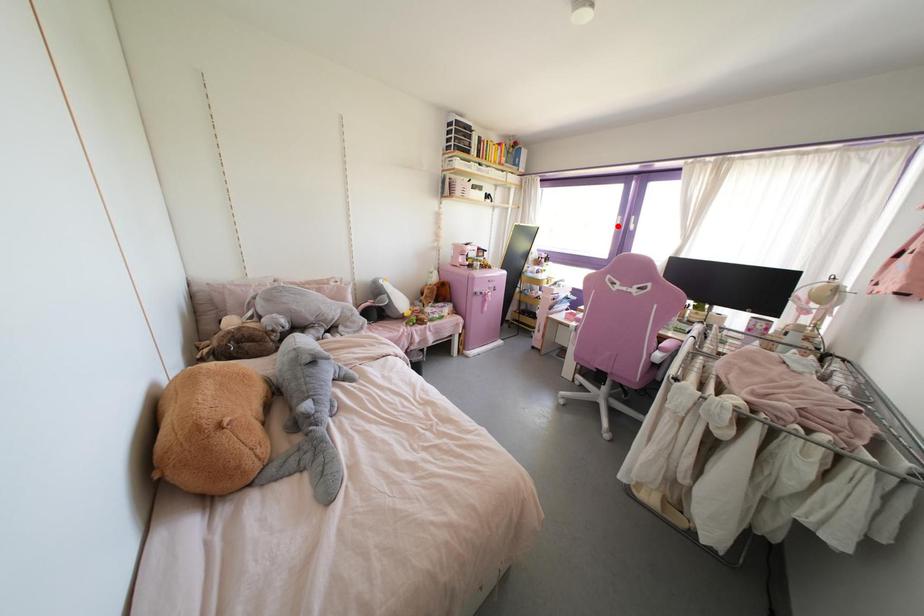
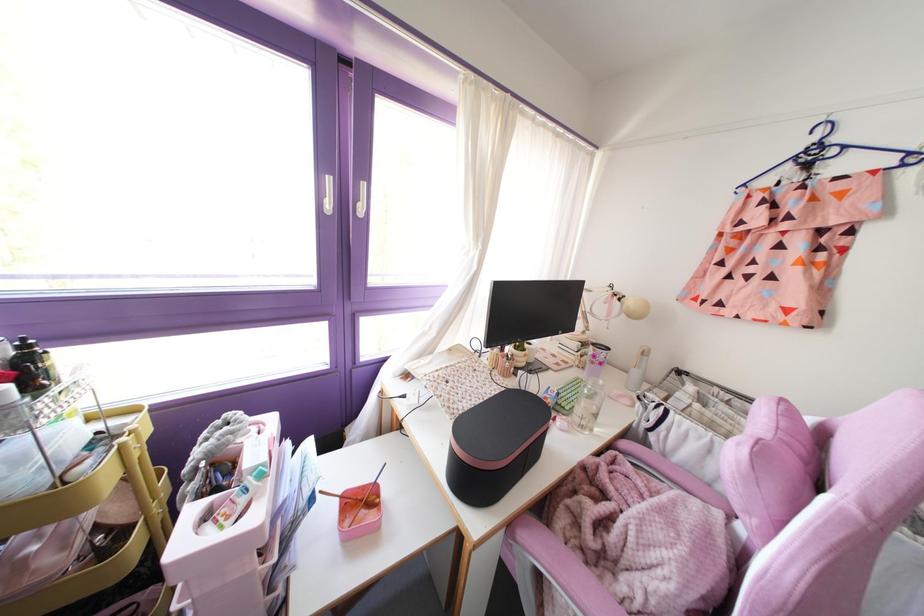
Question: I am providing you with two images of the same scene from different viewpoints. Image1 has a red point marked. In image2, the corresponding 3D location appears at what relative position? Reply with the corresponding letter.

Choices:
 (A) Closer
 (B) Farther

Answer: (B)